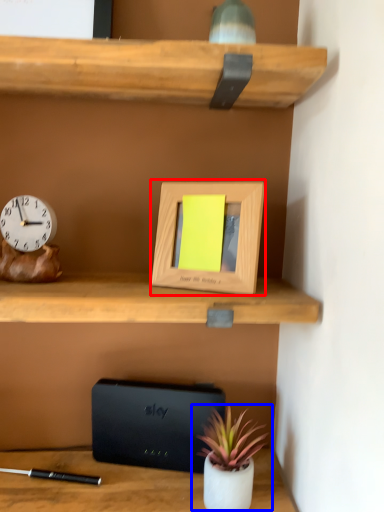
Question: Which object is further to the camera taking this photo, picture frame (highlighted by a red box) or houseplant (highlighted by a blue box)?

Choices:
 (A) picture frame
 (B) houseplant

Answer: (B)